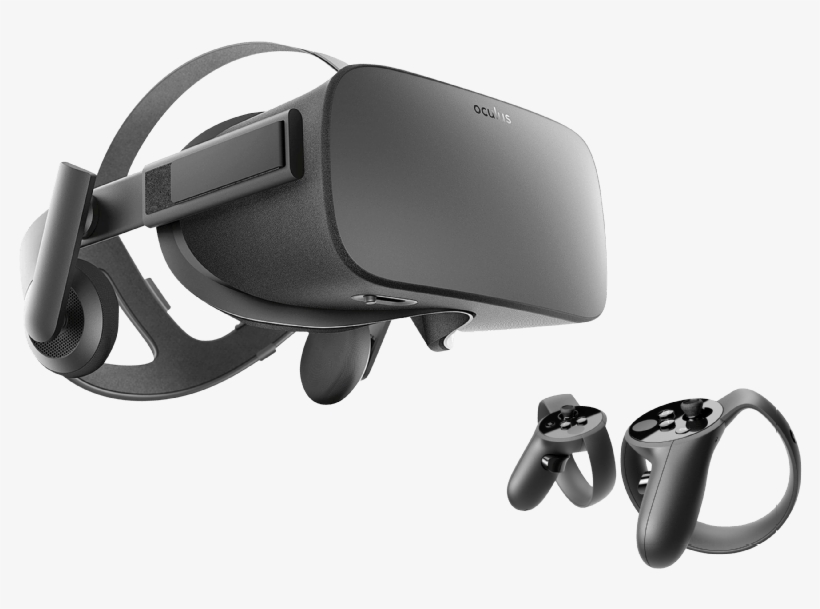
The width and height of the screenshot is (820, 609). What are the coordinates of `handles` in the screenshot? It's located at (654, 525), (534, 474).